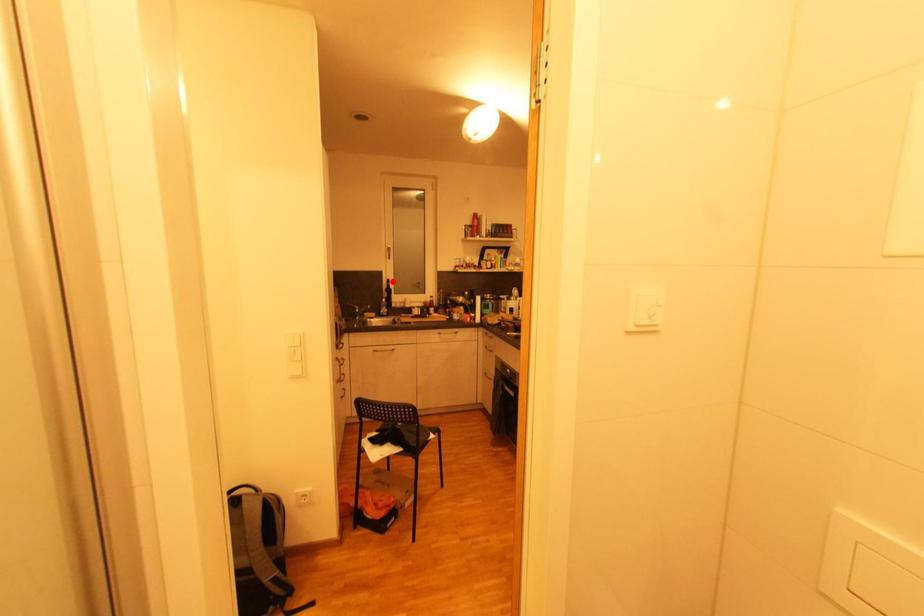
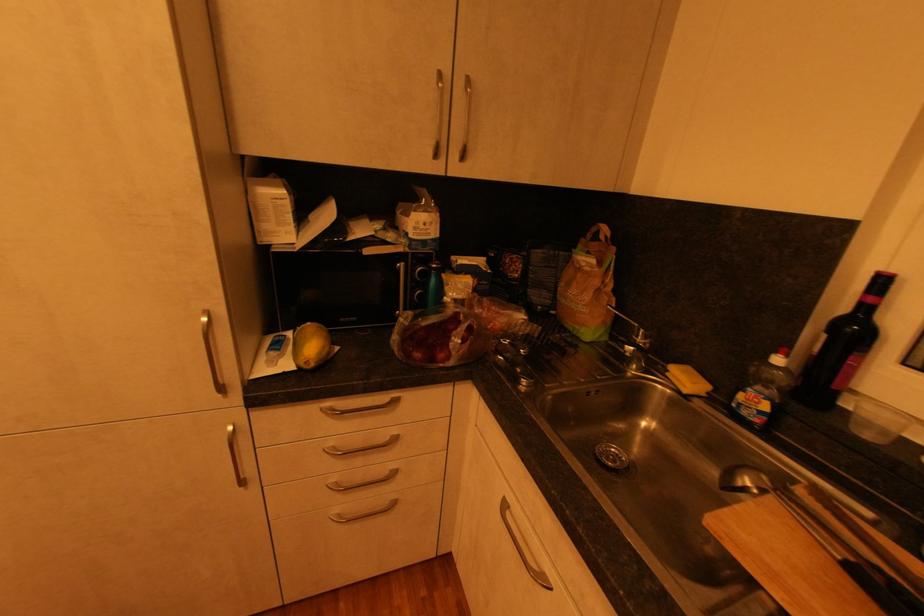
Question: I am providing you with two images of the same scene from different viewpoints. Image1 has a red point marked. In image2, the corresponding 3D location appears at what relative position? Reply with the corresponding letter.

Choices:
 (A) Closer
 (B) Farther

Answer: (B)